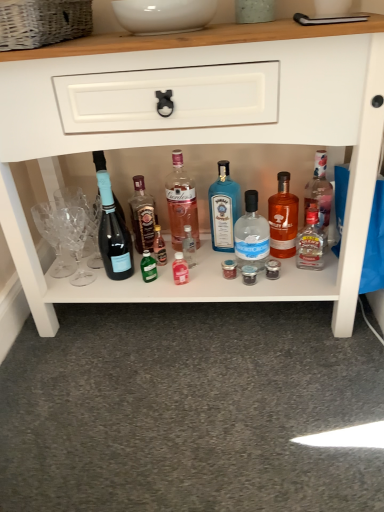
Question: Is pink glass bottle at center, positioned as the third bottle in left-to-right order, bigger than transparent glass bottle at center, arranged as the 5th bottle when viewed from the left?

Choices:
 (A) no
 (B) yes

Answer: (A)

Question: Is pink glass bottle at center, positioned as the third bottle in left-to-right order, at the right side of transparent glass bottle at center, the 3th bottle in the right-to-left sequence?

Choices:
 (A) yes
 (B) no

Answer: (B)

Question: Does pink glass bottle at center, placed as the fifth bottle when sorted from right to left, have a lesser height compared to transparent glass bottle at center, arranged as the 5th bottle when viewed from the left?

Choices:
 (A) no
 (B) yes

Answer: (A)

Question: Would you say pink glass bottle at center, positioned as the third bottle in left-to-right order, is outside transparent glass bottle at center, the 3th bottle in the right-to-left sequence?

Choices:
 (A) yes
 (B) no

Answer: (A)

Question: Considering the relative positions of pink glass bottle at center, placed as the fifth bottle when sorted from right to left, and transparent glass bottle at center, arranged as the 5th bottle when viewed from the left, in the image provided, is pink glass bottle at center, placed as the fifth bottle when sorted from right to left, to the left of transparent glass bottle at center, arranged as the 5th bottle when viewed from the left, from the viewer's perspective?

Choices:
 (A) yes
 (B) no

Answer: (A)

Question: Considering their positions, is translucent glass bottle at right, which is counted as the seventh bottle, starting from the left, located in front of or behind blue glass bottle at center, the fourth bottle positioned from the right?

Choices:
 (A) front
 (B) behind

Answer: (A)

Question: Based on their sizes in the image, would you say translucent glass bottle at right, which is counted as the seventh bottle, starting from the left, is bigger or smaller than blue glass bottle at center, the fourth bottle positioned from the right?

Choices:
 (A) small
 (B) big

Answer: (B)

Question: Would you say translucent glass bottle at right, arranged as the 1th bottle when viewed from the right, is inside or outside blue glass bottle at center, the fourth bottle positioned from the right?

Choices:
 (A) inside
 (B) outside

Answer: (B)

Question: Considering the positions of translucent glass bottle at right, which is counted as the seventh bottle, starting from the left, and blue glass bottle at center, marked as the fourth bottle in a left-to-right arrangement, in the image, is translucent glass bottle at right, which is counted as the seventh bottle, starting from the left, wider or thinner than blue glass bottle at center, marked as the fourth bottle in a left-to-right arrangement,?

Choices:
 (A) thin
 (B) wide

Answer: (B)

Question: From the image's perspective, relative to woven wicker basket at upper left, is translucent amber glass bottle at center-right, marked as the 2th bottle in a right-to-left arrangement, above or below?

Choices:
 (A) above
 (B) below

Answer: (B)

Question: Considering the positions of translucent amber glass bottle at center-right, marked as the 2th bottle in a right-to-left arrangement, and woven wicker basket at upper left in the image, is translucent amber glass bottle at center-right, marked as the 2th bottle in a right-to-left arrangement, taller or shorter than woven wicker basket at upper left?

Choices:
 (A) tall
 (B) short

Answer: (A)

Question: Visually, is translucent amber glass bottle at center-right, marked as the 2th bottle in a right-to-left arrangement, positioned to the left or to the right of woven wicker basket at upper left?

Choices:
 (A) left
 (B) right

Answer: (B)

Question: Is point (288, 237) closer or farther from the camera than point (29, 44)?

Choices:
 (A) closer
 (B) farther

Answer: (B)

Question: In terms of size, does transparent glass bottle at center, the 3th bottle in the right-to-left sequence, appear bigger or smaller than pink glass bottle at center, placed as the fifth bottle when sorted from right to left?

Choices:
 (A) small
 (B) big

Answer: (B)

Question: Does point (248, 237) appear closer or farther from the camera than point (188, 187)?

Choices:
 (A) closer
 (B) farther

Answer: (A)